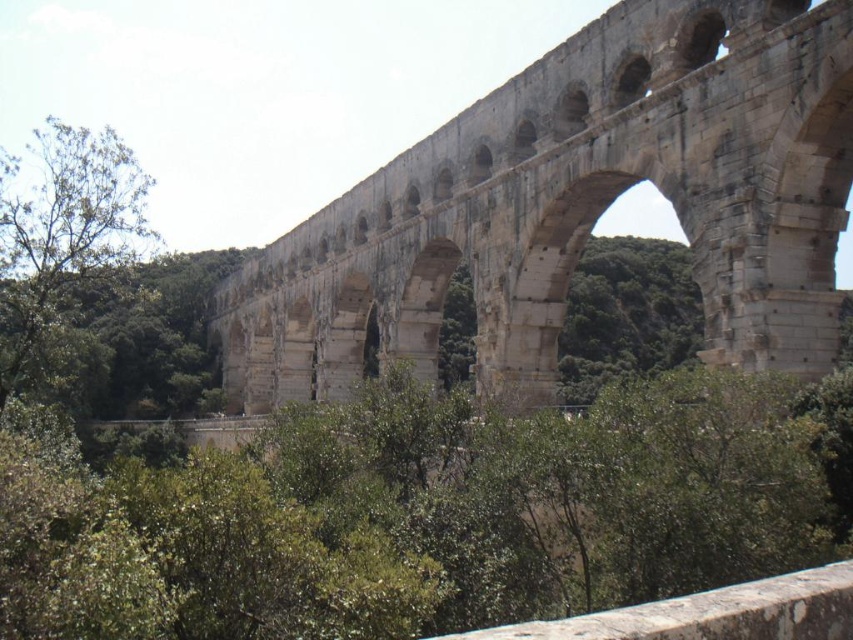
Question: Which point appears farthest from the camera in this image?

Choices:
 (A) (784, 296)
 (B) (33, 205)

Answer: (B)

Question: Can you confirm if stone arch bridge at center is positioned to the right of green leafy tree at left?

Choices:
 (A) yes
 (B) no

Answer: (A)

Question: Which point is farther to the camera?

Choices:
 (A) (62, 228)
 (B) (645, 76)

Answer: (A)

Question: Does stone arch bridge at center have a smaller size compared to green leafy tree at left?

Choices:
 (A) yes
 (B) no

Answer: (A)

Question: Does stone arch bridge at center have a smaller size compared to green leafy tree at left?

Choices:
 (A) yes
 (B) no

Answer: (A)